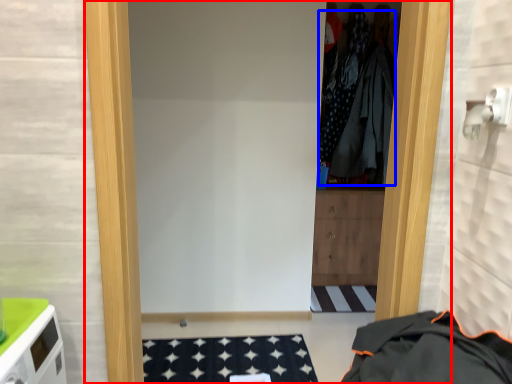
Question: Which object is closer to the camera taking this photo, door (highlighted by a red box) or clothing (highlighted by a blue box)?

Choices:
 (A) door
 (B) clothing

Answer: (A)